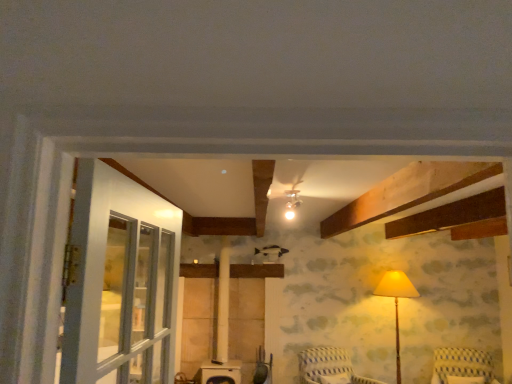
Where is `matte yellow fabric lampshade at right`? matte yellow fabric lampshade at right is located at coordinates pyautogui.click(x=396, y=301).

From the picture: Measure the distance from yellow striped fabric chair at lower right, the first furniture when ordered from right to left, to striped fabric chair at lower center, acting as the first furniture starting from the left.

A distance of 3.51 feet exists between yellow striped fabric chair at lower right, the first furniture when ordered from right to left, and striped fabric chair at lower center, acting as the first furniture starting from the left.

The height and width of the screenshot is (384, 512). Identify the location of furniture located above the striped fabric chair at lower center, the second furniture in the right-to-left sequence (from a real-world perspective). (462, 365).

Which is in front, point (476, 363) or point (301, 358)?

The point (476, 363) is closer to the camera.

From a real-world perspective, is yellow striped fabric chair at lower right, which is the second furniture from left to right, positioned above or below striped fabric chair at lower center, the second furniture in the right-to-left sequence?

From a real-world perspective, yellow striped fabric chair at lower right, which is the second furniture from left to right, is physically above striped fabric chair at lower center, the second furniture in the right-to-left sequence.

From the image's perspective, between striped fabric chair at lower center, acting as the first furniture starting from the left, and yellow striped fabric chair at lower right, the first furniture when ordered from right to left, who is located below?

From the image's view, yellow striped fabric chair at lower right, the first furniture when ordered from right to left, is below.

Considering the relative positions of striped fabric chair at lower center, acting as the first furniture starting from the left, and yellow striped fabric chair at lower right, the first furniture when ordered from right to left, in the image provided, is striped fabric chair at lower center, acting as the first furniture starting from the left, to the left or to the right of yellow striped fabric chair at lower right, the first furniture when ordered from right to left,?

Based on their positions, striped fabric chair at lower center, acting as the first furniture starting from the left, is located to the left of yellow striped fabric chair at lower right, the first furniture when ordered from right to left.

Is point (343, 358) closer to viewer compared to point (402, 286)?

Yes.

Is striped fabric chair at lower center, the second furniture in the right-to-left sequence, further to camera compared to matte yellow fabric lampshade at right?

No, the depth of striped fabric chair at lower center, the second furniture in the right-to-left sequence, is less than that of matte yellow fabric lampshade at right.

At what (x,y) coordinates should I click in order to perform the action: click on table lamp that appears on the right of striped fabric chair at lower center, acting as the first furniture starting from the left. Please return your answer as a coordinate pair (x, y). The image size is (512, 384). Looking at the image, I should click on (396, 301).

Is striped fabric chair at lower center, the second furniture in the right-to-left sequence, to the right of matte yellow fabric lampshade at right from the viewer's perspective?

No, striped fabric chair at lower center, the second furniture in the right-to-left sequence, is not to the right of matte yellow fabric lampshade at right.

Are yellow striped fabric chair at lower right, which is the second furniture from left to right, and matte yellow fabric lampshade at right far apart?

Actually, yellow striped fabric chair at lower right, which is the second furniture from left to right, and matte yellow fabric lampshade at right are a little close together.

From their relative heights in the image, would you say yellow striped fabric chair at lower right, the first furniture when ordered from right to left, is taller or shorter than matte yellow fabric lampshade at right?

Clearly, yellow striped fabric chair at lower right, the first furniture when ordered from right to left, is shorter compared to matte yellow fabric lampshade at right.

Does point (493, 375) come farther from viewer compared to point (385, 279)?

No, (493, 375) is closer to viewer.

Does yellow striped fabric chair at lower right, which is the second furniture from left to right, have a lesser width compared to matte yellow fabric lampshade at right?

No, yellow striped fabric chair at lower right, which is the second furniture from left to right, is not thinner than matte yellow fabric lampshade at right.

Is matte yellow fabric lampshade at right located outside yellow striped fabric chair at lower right, which is the second furniture from left to right?

Absolutely, matte yellow fabric lampshade at right is external to yellow striped fabric chair at lower right, which is the second furniture from left to right.

How much distance is there between matte yellow fabric lampshade at right and yellow striped fabric chair at lower right, which is the second furniture from left to right?

matte yellow fabric lampshade at right and yellow striped fabric chair at lower right, which is the second furniture from left to right, are 32.59 inches apart.

Does matte yellow fabric lampshade at right have a lesser height compared to yellow striped fabric chair at lower right, which is the second furniture from left to right?

No, matte yellow fabric lampshade at right is not shorter than yellow striped fabric chair at lower right, which is the second furniture from left to right.

Is matte yellow fabric lampshade at right oriented towards yellow striped fabric chair at lower right, which is the second furniture from left to right?

No, matte yellow fabric lampshade at right is not turned towards yellow striped fabric chair at lower right, which is the second furniture from left to right.

From their relative heights in the image, would you say matte yellow fabric lampshade at right is taller or shorter than striped fabric chair at lower center, acting as the first furniture starting from the left?

Considering their sizes, matte yellow fabric lampshade at right has more height than striped fabric chair at lower center, acting as the first furniture starting from the left.

Measure the distance from matte yellow fabric lampshade at right to striped fabric chair at lower center, the second furniture in the right-to-left sequence.

The distance of matte yellow fabric lampshade at right from striped fabric chair at lower center, the second furniture in the right-to-left sequence, is 39.20 inches.

In terms of width, does matte yellow fabric lampshade at right look wider or thinner when compared to striped fabric chair at lower center, the second furniture in the right-to-left sequence?

In the image, matte yellow fabric lampshade at right appears to be more narrow than striped fabric chair at lower center, the second furniture in the right-to-left sequence.

Is matte yellow fabric lampshade at right inside or outside of striped fabric chair at lower center, the second furniture in the right-to-left sequence?

matte yellow fabric lampshade at right cannot be found inside striped fabric chair at lower center, the second furniture in the right-to-left sequence.

The image size is (512, 384). What are the coordinates of `furniture on the right of striped fabric chair at lower center, acting as the first furniture starting from the left` in the screenshot? It's located at (462, 365).

At what (x,y) coordinates should I click in order to perform the action: click on furniture that appears below the yellow striped fabric chair at lower right, the first furniture when ordered from right to left (from a real-world perspective). Please return your answer as a coordinate pair (x, y). Looking at the image, I should click on (328, 367).

Which object lies further to the anchor point matte yellow fabric lampshade at right, striped fabric chair at lower center, acting as the first furniture starting from the left, or yellow striped fabric chair at lower right, which is the second furniture from left to right?

striped fabric chair at lower center, acting as the first furniture starting from the left, is positioned further to the anchor matte yellow fabric lampshade at right.

Considering their positions, is striped fabric chair at lower center, the second furniture in the right-to-left sequence, positioned closer to yellow striped fabric chair at lower right, which is the second furniture from left to right, than matte yellow fabric lampshade at right?

Based on the image, matte yellow fabric lampshade at right appears to be nearer to yellow striped fabric chair at lower right, which is the second furniture from left to right.

Estimate the real-world distances between objects in this image. Which object is further from striped fabric chair at lower center, acting as the first furniture starting from the left, yellow striped fabric chair at lower right, the first furniture when ordered from right to left, or matte yellow fabric lampshade at right?

yellow striped fabric chair at lower right, the first furniture when ordered from right to left, is further to striped fabric chair at lower center, acting as the first furniture starting from the left.

Based on the photo, which object lies further to the anchor point striped fabric chair at lower center, the second furniture in the right-to-left sequence, matte yellow fabric lampshade at right or yellow striped fabric chair at lower right, which is the second furniture from left to right?

yellow striped fabric chair at lower right, which is the second furniture from left to right.

Based on the photo, which object lies further to the anchor point matte yellow fabric lampshade at right, yellow striped fabric chair at lower right, which is the second furniture from left to right, or striped fabric chair at lower center, acting as the first furniture starting from the left?

Among the two, striped fabric chair at lower center, acting as the first furniture starting from the left, is located further to matte yellow fabric lampshade at right.

Looking at the image, which one is located closer to yellow striped fabric chair at lower right, which is the second furniture from left to right, matte yellow fabric lampshade at right or striped fabric chair at lower center, acting as the first furniture starting from the left?

matte yellow fabric lampshade at right lies closer to yellow striped fabric chair at lower right, which is the second furniture from left to right, than the other object.

The height and width of the screenshot is (384, 512). Identify the location of table lamp between striped fabric chair at lower center, acting as the first furniture starting from the left, and yellow striped fabric chair at lower right, which is the second furniture from left to right. (396, 301).